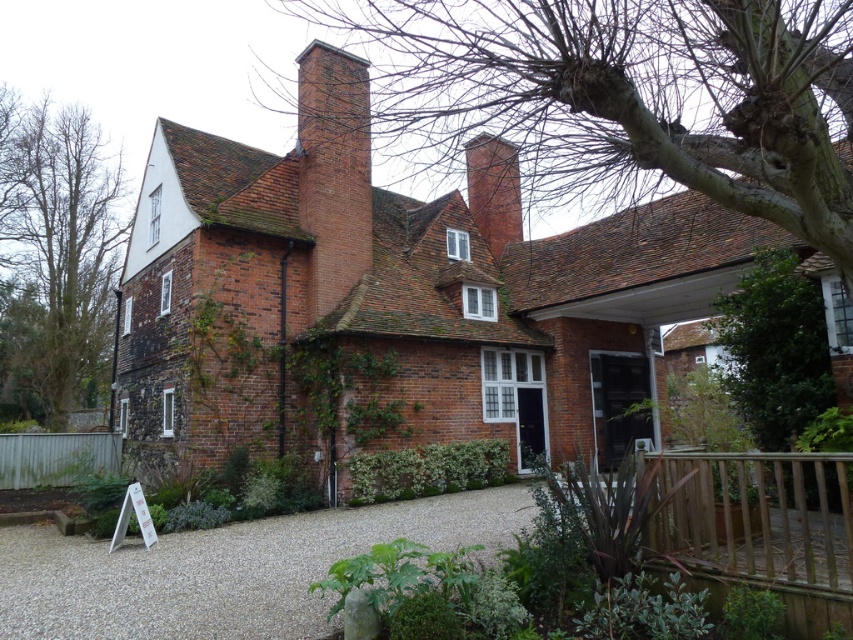
Does point (204, 621) come behind point (367, 138)?

No, (204, 621) is closer to viewer.

Can you confirm if gray gravel at lower center is wider than brick chimney at center?

Yes.

Does point (138, 580) come behind point (358, 188)?

No, it is in front of (358, 188).

Where is `gray gravel at lower center`? The width and height of the screenshot is (853, 640). gray gravel at lower center is located at coordinates 227,570.

Can you confirm if brick house at center is taller than brown leafless tree at left?

In fact, brick house at center may be shorter than brown leafless tree at left.

Between point (321, 51) and point (16, 284), which one is positioned in front?

Point (321, 51) is more forward.

Identify the location of brick house at center. (392, 298).

Looking at this image, does brick house at center appear under gray gravel at lower center?

Incorrect, brick house at center is not positioned below gray gravel at lower center.

Who is more forward, [234,244] or [260,600]?

Positioned in front is point [260,600].

Is point (547, 336) positioned after point (265, 525)?

Yes, point (547, 336) is behind point (265, 525).

The width and height of the screenshot is (853, 640). What are the coordinates of `brick house at center` in the screenshot? It's located at (392, 298).